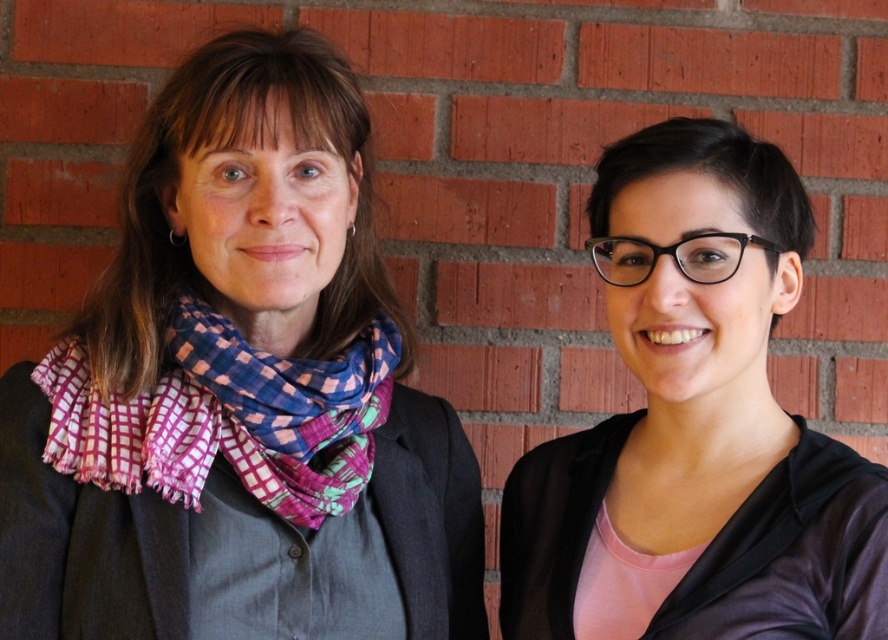
Is black glossy glasses at upper right closer to the viewer compared to multicolored woven scarf at left?

Yes, it is in front of multicolored woven scarf at left.

Which is more to the right, black glossy glasses at upper right or multicolored woven scarf at left?

black glossy glasses at upper right is more to the right.

Identify the location of black glossy glasses at upper right. This screenshot has height=640, width=888. (695, 426).

The image size is (888, 640). Find the location of `black glossy glasses at upper right`. black glossy glasses at upper right is located at coordinates (695, 426).

Is point (248, 108) positioned behind point (655, 282)?

Yes, it is behind point (655, 282).

Is multicolored woven scarf at center shorter than black glossy glasses at upper right?

Incorrect, multicolored woven scarf at center's height does not fall short of black glossy glasses at upper right's.

You are a GUI agent. You are given a task and a screenshot of the screen. Output one action in this format:
    pyautogui.click(x=<x>, y=<y>)
    Task: Click on the multicolored woven scarf at center
    This screenshot has height=640, width=888.
    Given the screenshot: What is the action you would take?
    pyautogui.click(x=239, y=392)

Consider the image. Is multicolored woven scarf at center further to camera compared to multicolored woven scarf at left?

That is False.

Locate an element on the screen. The width and height of the screenshot is (888, 640). multicolored woven scarf at center is located at coordinates (239, 392).

Image resolution: width=888 pixels, height=640 pixels. I want to click on multicolored woven scarf at center, so click(239, 392).